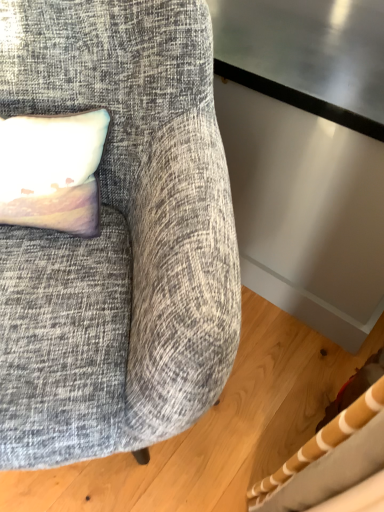
What do you see at coordinates (52, 170) in the screenshot?
I see `pastel fabric pillow at upper left` at bounding box center [52, 170].

Find the location of a particular element. Image resolution: width=384 pixels, height=512 pixels. pastel fabric pillow at upper left is located at coordinates (52, 170).

Describe the element at coordinates (118, 236) in the screenshot. I see `textured gray fabric chair at upper left` at that location.

Locate an element on the screen. textured gray fabric chair at upper left is located at coordinates (118, 236).

Image resolution: width=384 pixels, height=512 pixels. I want to click on pastel fabric pillow at upper left, so click(x=52, y=170).

Does textured gray fabric chair at upper left appear on the right side of pastel fabric pillow at upper left?

Indeed, textured gray fabric chair at upper left is positioned on the right side of pastel fabric pillow at upper left.

Is the position of textured gray fabric chair at upper left less distant than that of pastel fabric pillow at upper left?

That is True.

Between point (202, 165) and point (11, 119), which one is positioned behind?

The point (11, 119) is farther from the camera.

From the image's perspective, between textured gray fabric chair at upper left and pastel fabric pillow at upper left, which one is located above?

From the image's view, pastel fabric pillow at upper left is above.

From a real-world perspective, is textured gray fabric chair at upper left positioned over pastel fabric pillow at upper left based on gravity?

No, from a real-world perspective, textured gray fabric chair at upper left is not over pastel fabric pillow at upper left

Between textured gray fabric chair at upper left and pastel fabric pillow at upper left, which one has smaller width?

pastel fabric pillow at upper left is thinner.

Who is taller, textured gray fabric chair at upper left or pastel fabric pillow at upper left?

Standing taller between the two is textured gray fabric chair at upper left.

Is textured gray fabric chair at upper left bigger or smaller than pastel fabric pillow at upper left?

Considering their sizes, textured gray fabric chair at upper left takes up more space than pastel fabric pillow at upper left.

Consider the image. Could pastel fabric pillow at upper left be considered to be inside textured gray fabric chair at upper left?

Yes.

Is textured gray fabric chair at upper left touching pastel fabric pillow at upper left?

No, textured gray fabric chair at upper left is not with pastel fabric pillow at upper left.

Is textured gray fabric chair at upper left turned away from pastel fabric pillow at upper left?

That's right, textured gray fabric chair at upper left is facing away from pastel fabric pillow at upper left.

Consider the image. How many degrees apart are the facing directions of textured gray fabric chair at upper left and pastel fabric pillow at upper left?

The angle between the facing direction of textured gray fabric chair at upper left and the facing direction of pastel fabric pillow at upper left is 5.81 degrees.

Locate an element on the screen. pillow on the left of textured gray fabric chair at upper left is located at coordinates (52, 170).

Does pastel fabric pillow at upper left appear on the right side of textured gray fabric chair at upper left?

No.

Which object is more forward, pastel fabric pillow at upper left or textured gray fabric chair at upper left?

Positioned in front is textured gray fabric chair at upper left.

Which is in front, point (26, 173) or point (117, 230)?

The point (26, 173) is more forward.

From the image's perspective, who appears lower, pastel fabric pillow at upper left or textured gray fabric chair at upper left?

textured gray fabric chair at upper left, from the image's perspective.

From a real-world perspective, who is located higher, pastel fabric pillow at upper left or textured gray fabric chair at upper left?

In real-world perspective, pastel fabric pillow at upper left is above.

Considering the sizes of objects pastel fabric pillow at upper left and textured gray fabric chair at upper left in the image provided, who is thinner, pastel fabric pillow at upper left or textured gray fabric chair at upper left?

With smaller width is pastel fabric pillow at upper left.

From their relative heights in the image, would you say pastel fabric pillow at upper left is taller or shorter than textured gray fabric chair at upper left?

pastel fabric pillow at upper left is shorter than textured gray fabric chair at upper left.

Considering the sizes of objects pastel fabric pillow at upper left and textured gray fabric chair at upper left in the image provided, who is bigger, pastel fabric pillow at upper left or textured gray fabric chair at upper left?

Bigger between the two is textured gray fabric chair at upper left.

Which is correct: pastel fabric pillow at upper left is inside textured gray fabric chair at upper left, or outside of it?

pastel fabric pillow at upper left exists entirely within textured gray fabric chair at upper left.

Looking at this image, is pastel fabric pillow at upper left not near textured gray fabric chair at upper left?

They are positioned close to each other.

Does pastel fabric pillow at upper left turn towards textured gray fabric chair at upper left?

Yes, pastel fabric pillow at upper left faces towards textured gray fabric chair at upper left.

What's the angular difference between pastel fabric pillow at upper left and textured gray fabric chair at upper left's facing directions?

The facing directions of pastel fabric pillow at upper left and textured gray fabric chair at upper left are 5.81 degrees apart.

Identify the location of pillow located on the left of textured gray fabric chair at upper left. (52, 170).

Locate an element on the screen. chair in front of the pastel fabric pillow at upper left is located at coordinates (118, 236).

Locate an element on the screen. This screenshot has width=384, height=512. chair below the pastel fabric pillow at upper left (from the image's perspective) is located at coordinates (118, 236).